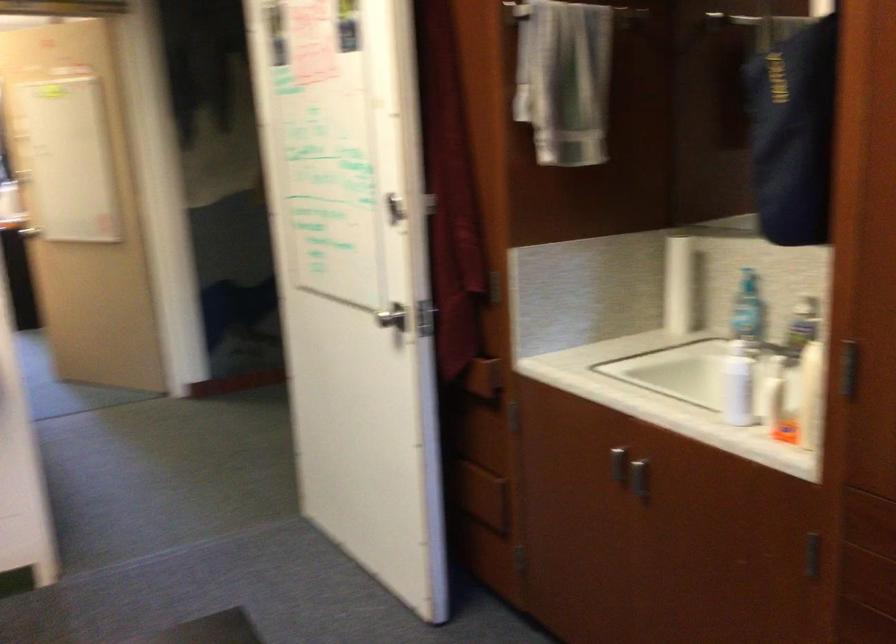
Find the location of a particular element. This screenshot has width=896, height=644. metal towel rack is located at coordinates (589, 11).